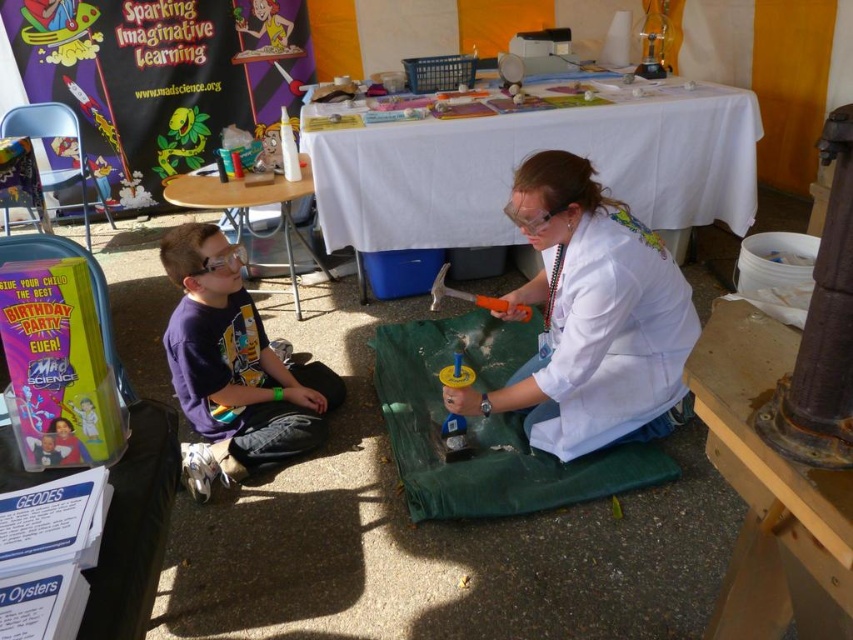
Is white cloth-covered table at center closer to the viewer compared to wooden folding table at center?

That is False.

Is white cloth-covered table at center to the right of wooden folding table at center from the viewer's perspective?

Correct, you'll find white cloth-covered table at center to the right of wooden folding table at center.

Find the location of a particular element. The width and height of the screenshot is (853, 640). white cloth-covered table at center is located at coordinates click(532, 152).

Is white paper at lower left below wooden folding table at center?

Indeed, white paper at lower left is positioned under wooden folding table at center.

The width and height of the screenshot is (853, 640). I want to click on white paper at lower left, so click(134, 528).

Locate an element on the screen. The image size is (853, 640). white paper at lower left is located at coordinates (134, 528).

Between point (671, 316) and point (161, 552), which one is positioned behind?

Positioned behind is point (671, 316).

Does point (639, 435) come behind point (126, 632)?

That is True.

Find the location of a particular element. The height and width of the screenshot is (640, 853). white lab coat at center is located at coordinates (590, 317).